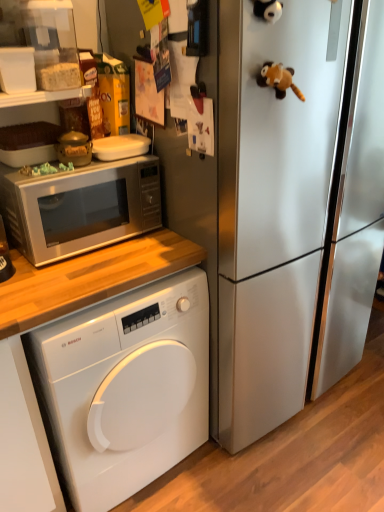
Question: From a real-world perspective, is satin silver microwave at upper left located higher than brown plush toy at upper right?

Choices:
 (A) no
 (B) yes

Answer: (A)

Question: Does satin silver microwave at upper left lie in front of brown plush toy at upper right?

Choices:
 (A) yes
 (B) no

Answer: (B)

Question: Is satin silver microwave at upper left not close to brown plush toy at upper right?

Choices:
 (A) yes
 (B) no

Answer: (B)

Question: Is the position of satin silver microwave at upper left more distant than that of brown plush toy at upper right?

Choices:
 (A) no
 (B) yes

Answer: (B)

Question: Is satin silver microwave at upper left touching brown plush toy at upper right?

Choices:
 (A) yes
 (B) no

Answer: (B)

Question: Is satin silver microwave at upper left positioned with its back to brown plush toy at upper right?

Choices:
 (A) yes
 (B) no

Answer: (B)

Question: Would you say white glossy washing machine at lower left is part of brown plush toy at upper right's contents?

Choices:
 (A) no
 (B) yes

Answer: (A)

Question: Does brown plush toy at upper right have a lesser width compared to white glossy washing machine at lower left?

Choices:
 (A) yes
 (B) no

Answer: (A)

Question: Considering the relative positions of brown plush toy at upper right and white glossy washing machine at lower left in the image provided, is brown plush toy at upper right to the right of white glossy washing machine at lower left from the viewer's perspective?

Choices:
 (A) no
 (B) yes

Answer: (B)

Question: Is brown plush toy at upper right at the left side of white glossy washing machine at lower left?

Choices:
 (A) yes
 (B) no

Answer: (B)

Question: From the image's perspective, is brown plush toy at upper right beneath white glossy washing machine at lower left?

Choices:
 (A) yes
 (B) no

Answer: (B)

Question: Is brown plush toy at upper right bigger than white glossy washing machine at lower left?

Choices:
 (A) yes
 (B) no

Answer: (B)

Question: Does satin silver refrigerator at center have a greater height compared to brown plush toy at upper right?

Choices:
 (A) yes
 (B) no

Answer: (A)